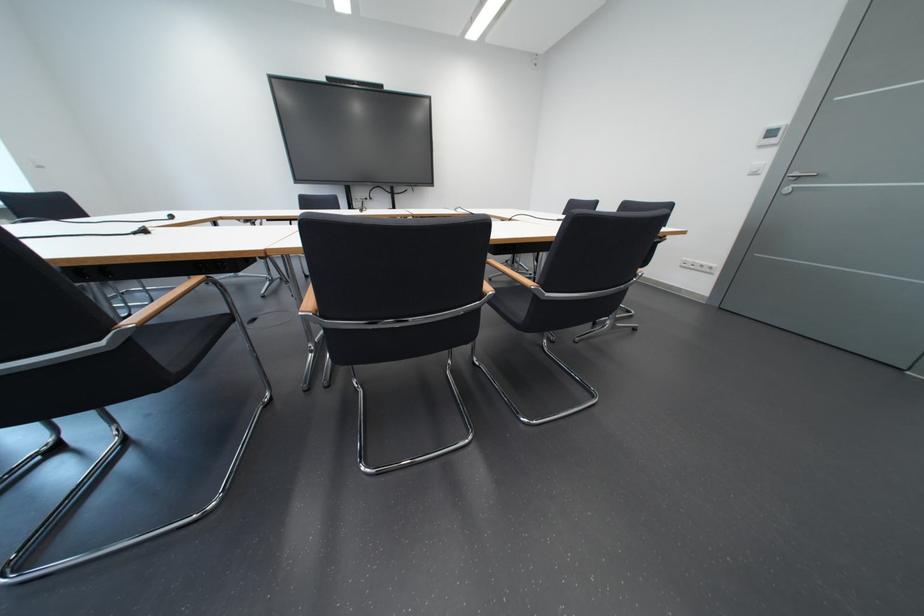
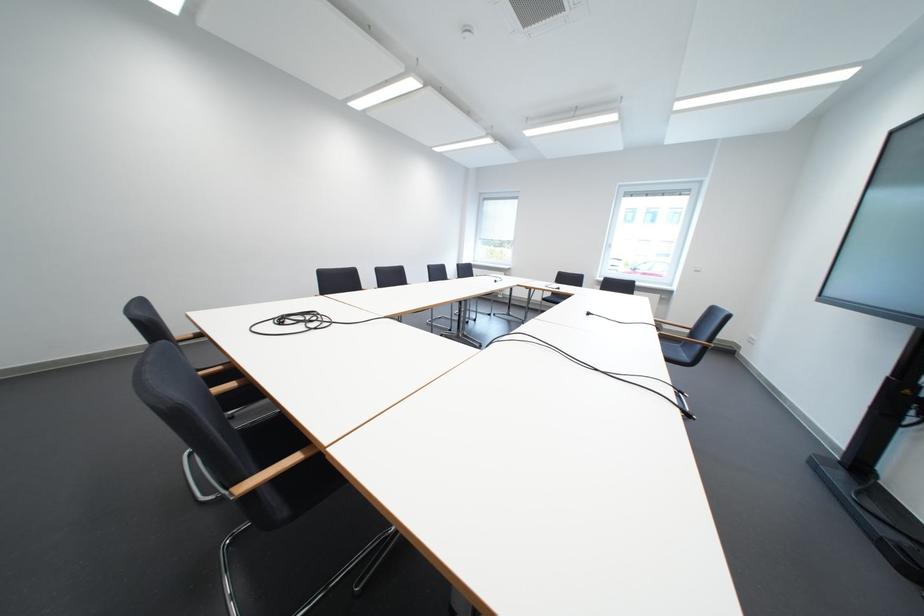
Find the pixel in the second image that matches [372,212] in the first image.

(601, 315)